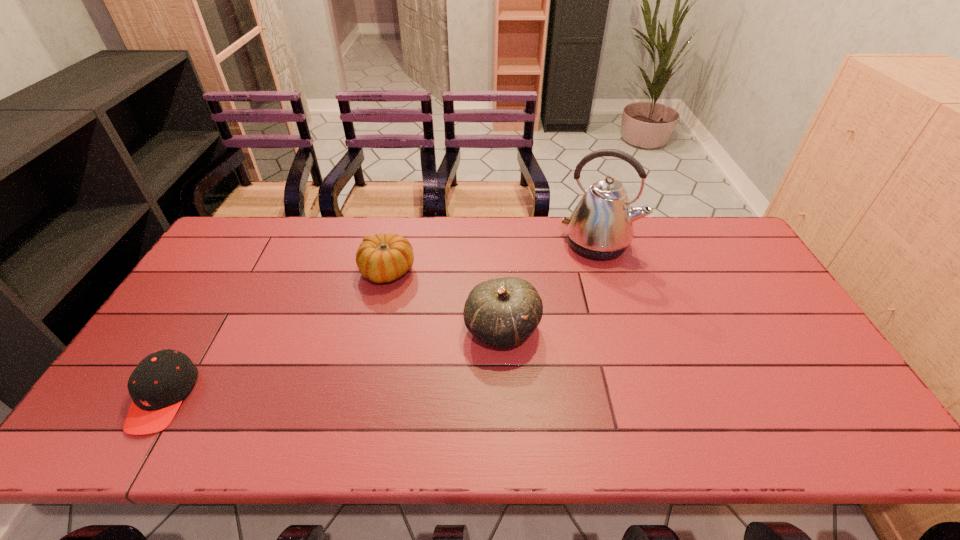
This screenshot has height=540, width=960. What are the coordinates of `the tallest object` in the screenshot? It's located at (601, 226).

Locate an element on the screen. This screenshot has width=960, height=540. the rightmost object is located at coordinates (601, 226).

Where is `the third shortest object`? the third shortest object is located at coordinates (503, 312).

You are a GUI agent. You are given a task and a screenshot of the screen. Output one action in this format:
    pyautogui.click(x=<x>, y=<y>)
    Task: Click on the taller gourd
    This screenshot has height=540, width=960.
    Given the screenshot: What is the action you would take?
    pyautogui.click(x=503, y=312)

The image size is (960, 540). In order to click on the farther gourd in this screenshot , I will do `click(382, 258)`.

The height and width of the screenshot is (540, 960). In order to click on the third object from right to left in this screenshot , I will do `click(382, 258)`.

Find the location of a particular element. The image size is (960, 540). the leftmost object is located at coordinates (158, 384).

This screenshot has height=540, width=960. Find the location of `the shortest object`. the shortest object is located at coordinates [x=158, y=384].

I want to click on free space located on the left of the rightmost object, so (x=444, y=244).

In order to click on vacant space located 0.180m on the left of the taller gourd in this screenshot , I will do `click(399, 329)`.